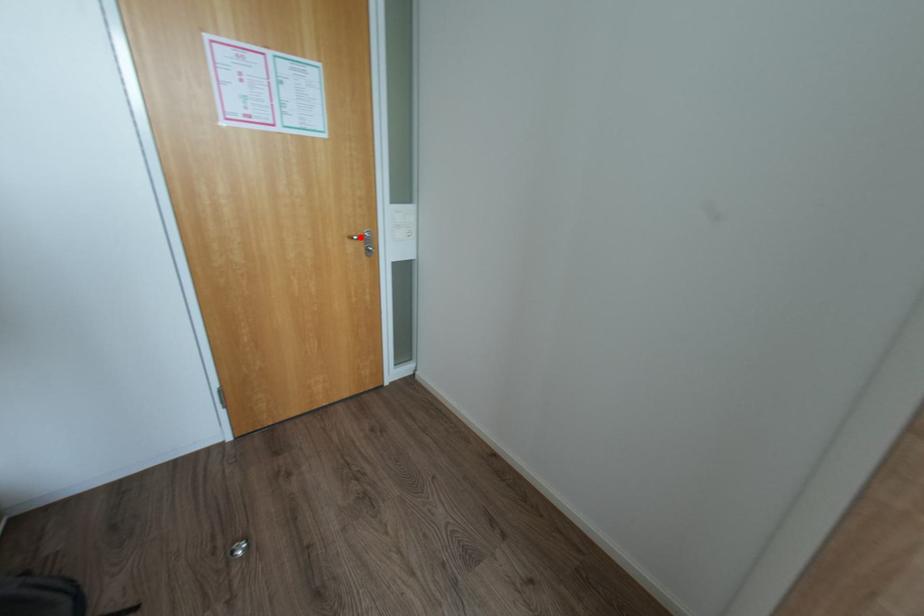
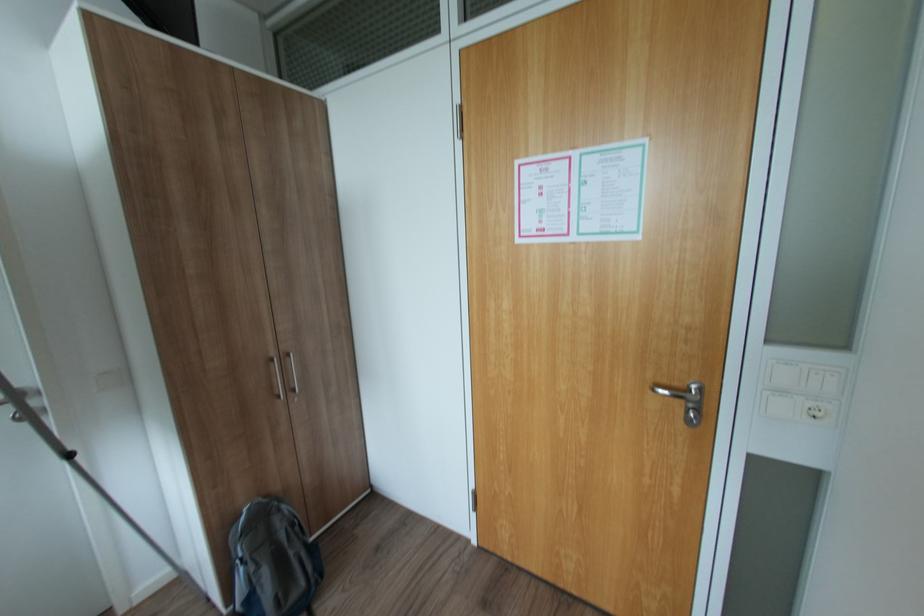
Question: A red point is marked in image1. In image2, is the corresponding 3D point closer to the camera or farther? Reply with the corresponding letter.

Choices:
 (A) The corresponding 3D point is closer.
 (B) The corresponding 3D point is farther.

Answer: (B)